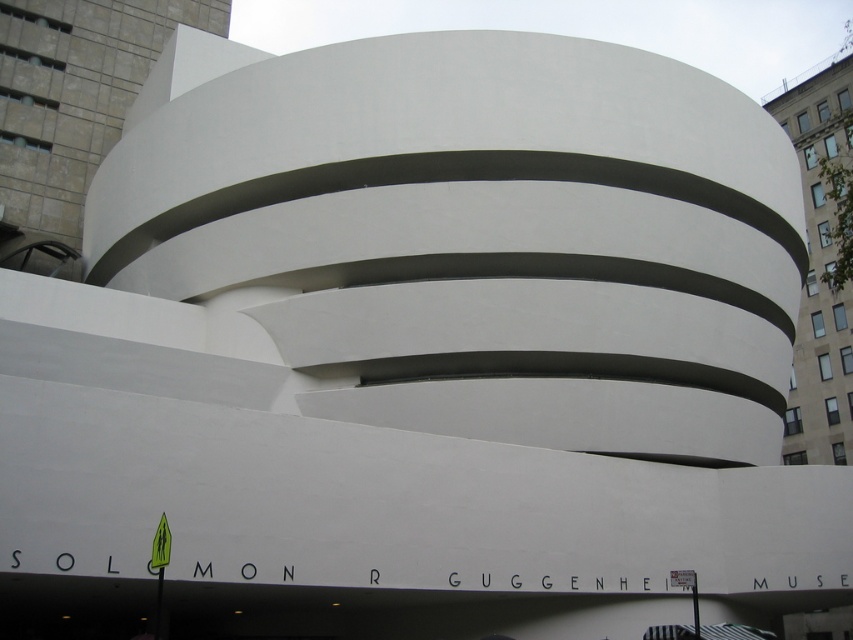
Question: Which point appears farthest from the camera in this image?

Choices:
 (A) coord(840,305)
 (B) coord(90,99)

Answer: (A)

Question: Which object is closer to the camera taking this photo?

Choices:
 (A) white smooth concrete at upper left
 (B) white smooth building at upper right

Answer: (B)

Question: Considering the relative positions of white smooth concrete at upper left and white smooth building at upper right in the image provided, where is white smooth concrete at upper left located with respect to white smooth building at upper right?

Choices:
 (A) below
 (B) above

Answer: (B)

Question: Can you confirm if white smooth concrete at upper left is positioned above white smooth building at upper right?

Choices:
 (A) yes
 (B) no

Answer: (A)

Question: Which point is farther to the camera?

Choices:
 (A) white smooth concrete at upper left
 (B) white smooth building at upper right

Answer: (A)

Question: Considering the relative positions of white smooth concrete at upper left and white smooth building at upper right in the image provided, where is white smooth concrete at upper left located with respect to white smooth building at upper right?

Choices:
 (A) below
 (B) above

Answer: (B)